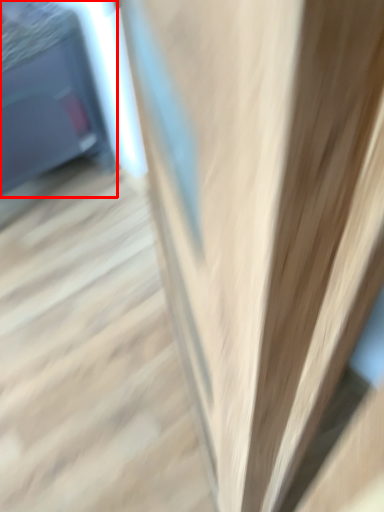
Question: From the image's perspective, where is furniture (annotated by the red box) located relative to stairs?

Choices:
 (A) above
 (B) below

Answer: (A)